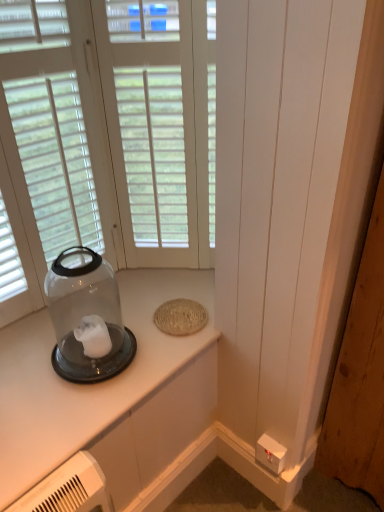
You are a GUI agent. You are given a task and a screenshot of the screen. Output one action in this format:
    pyautogui.click(x=<x>, y=<y>)
    Task: Click on the vacant region in front of transparent glass jar at left
    The image size is (384, 512).
    Given the screenshot: What is the action you would take?
    pyautogui.click(x=67, y=412)